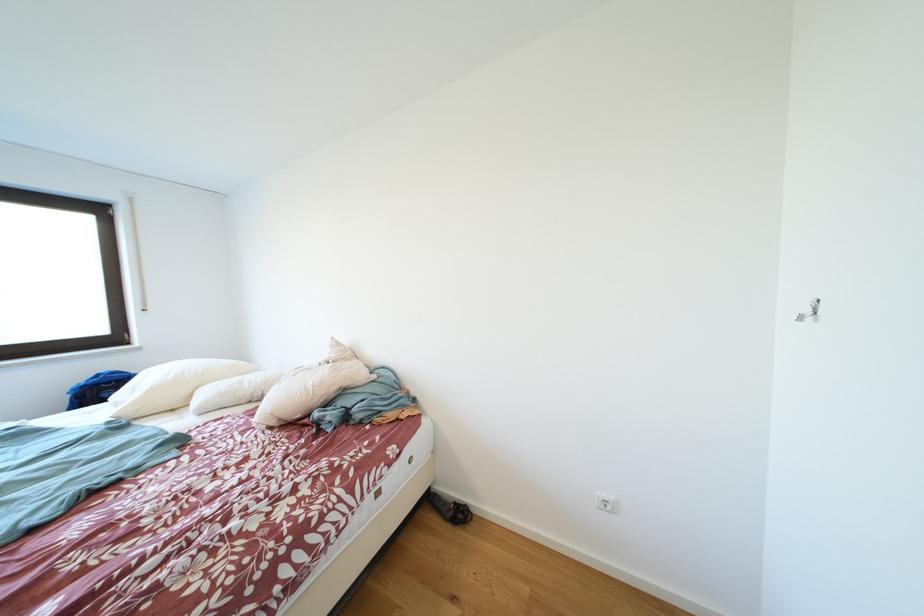
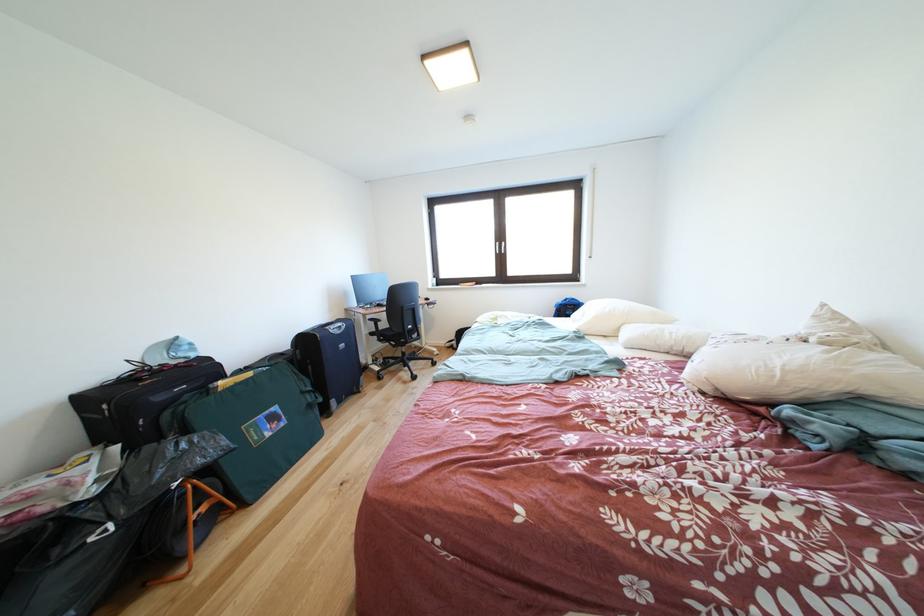
The point at (282, 428) is marked in the first image. Where is the corresponding point in the second image?

(716, 394)